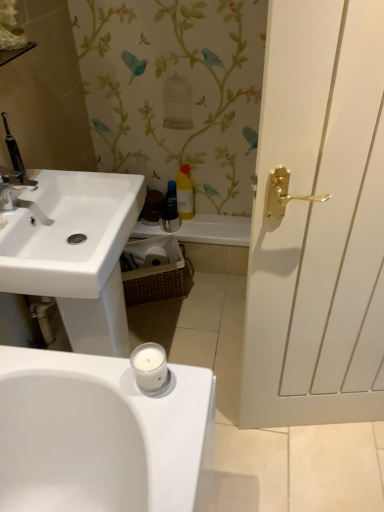
Image resolution: width=384 pixels, height=512 pixels. I want to click on free space in front of translucent plastic bottle at center, which ranks as the 1th toiletry in left-to-right order, so click(186, 228).